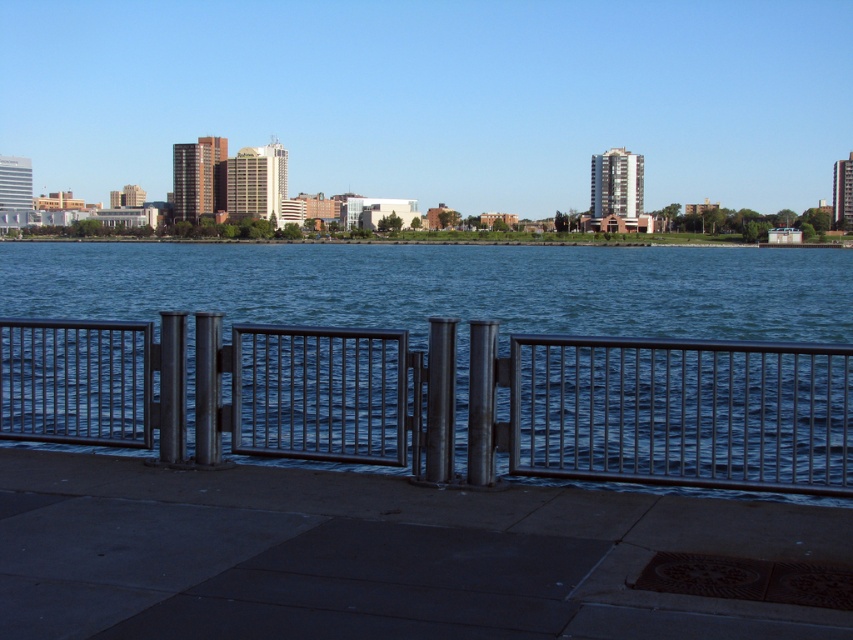
You are standing at the edge of the waterfront scene and want to reach the smooth concrete dock at lower center. According to the coordinates provided, where exactly should you look to find it?

The smooth concrete dock at lower center is located at coordinates point (x=372, y=556).

You are standing at the point marked by the coordinates point (372, 556). What is the name of the structure you are currently on?

The point (372, 556) corresponds to the smooth concrete dock at lower center, so you are currently on the smooth concrete dock at lower center.

You are a delivery robot that is 1.8 meters wide. You need to move from the smooth concrete dock at lower center to the polished metal gate at center. Can you fit through the space between them?

The smooth concrete dock at lower center and polished metal gate at center are 2.12 meters apart from each other. Since the robot is 1.8 meters wide, it can fit through the space between them as the distance is wider than the robot.